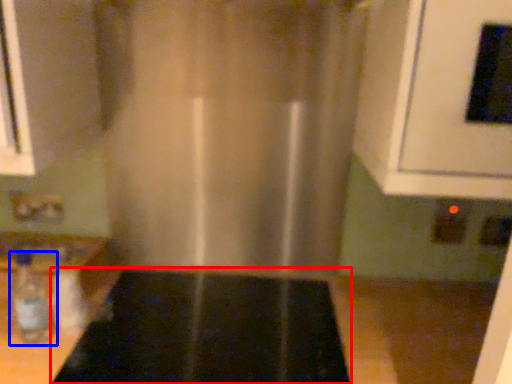
Question: Among these objects, which one is nearest to the camera, appliance (highlighted by a red box) or bottle (highlighted by a blue box)?

Choices:
 (A) appliance
 (B) bottle

Answer: (A)